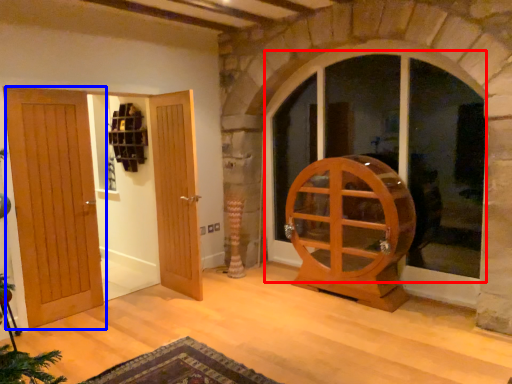
Question: Among these objects, which one is farthest to the camera, window (highlighted by a red box) or door (highlighted by a blue box)?

Choices:
 (A) window
 (B) door

Answer: (A)